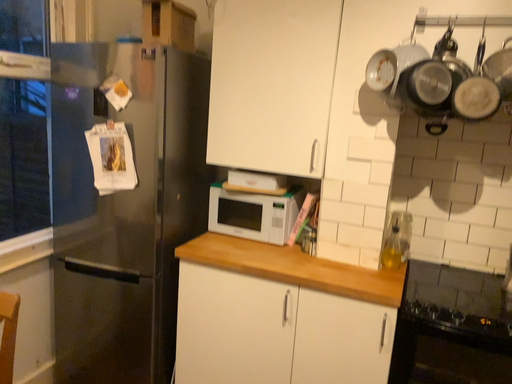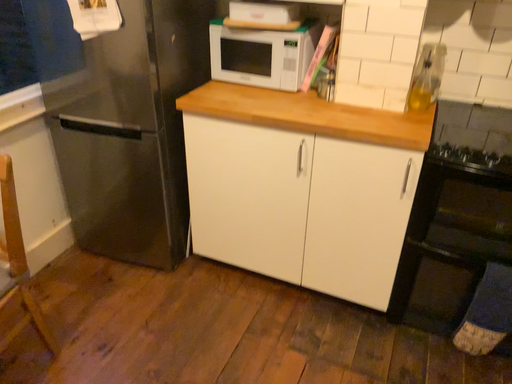
Question: How did the camera likely rotate when shooting the video?

Choices:
 (A) rotated downward
 (B) rotated upward

Answer: (A)